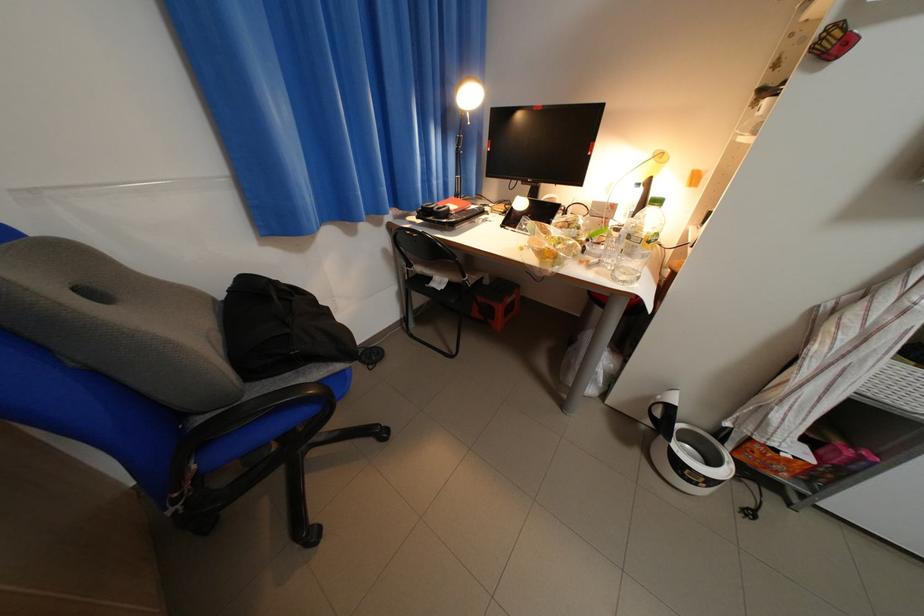
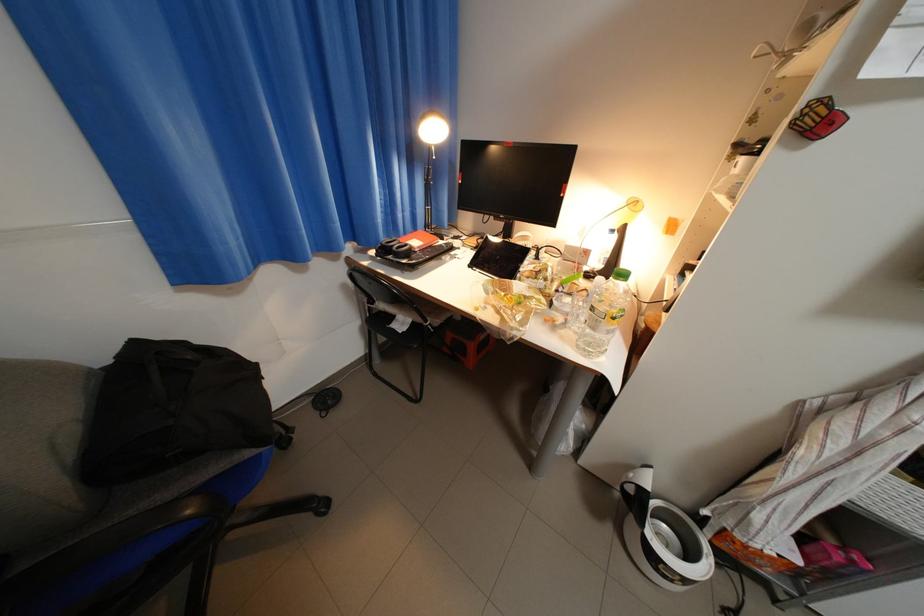
In a continuous first-person perspective shot, in which direction is the camera moving?

The cameraman moved toward right, forward.